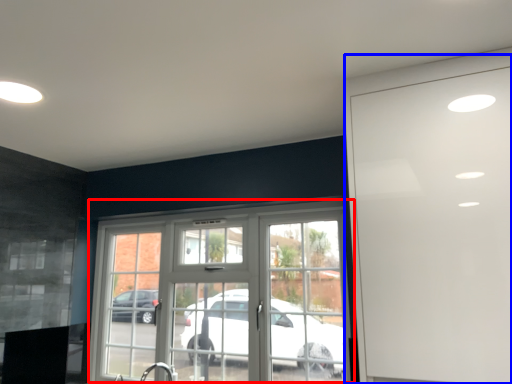
Question: Among these objects, which one is farthest to the camera, window (highlighted by a red box) or garage door (highlighted by a blue box)?

Choices:
 (A) window
 (B) garage door

Answer: (A)